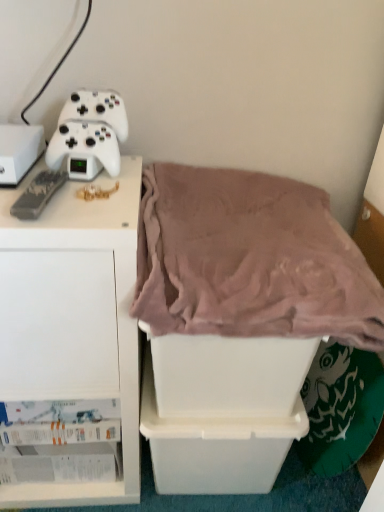
The image size is (384, 512). I want to click on mauve plush blanket at center, so click(x=250, y=260).

This screenshot has height=512, width=384. Describe the element at coordinates (228, 374) in the screenshot. I see `white plastic storage box at center, marked as the 2th storage box in a bottom-to-top arrangement` at that location.

The image size is (384, 512). What do you see at coordinates (216, 447) in the screenshot? I see `white plastic storage box at lower center, the 2th storage box when ordered from left to right` at bounding box center [216, 447].

What is the approximate height of white plastic storage box at lower center, the 3th storage box when ordered from top to bottom?

11.72 inches.

What do you see at coordinates (19, 151) in the screenshot? I see `white plastic storage box at left, arranged as the 1th storage box when viewed from the top` at bounding box center [19, 151].

Locate an element on the screen. white matte cabinet at left is located at coordinates (73, 319).

Is the depth of white plastic storage box at lower center, the 2th storage box when ordered from left to right, greater than that of mauve plush blanket at center?

Yes, it is.

Would you say white plastic storage box at lower center, the 3th storage box when ordered from top to bottom, is inside or outside mauve plush blanket at center?

The correct answer is: outside.

Which object is wider, white plastic storage box at lower center, the first storage box positioned from the bottom, or mauve plush blanket at center?

mauve plush blanket at center.

From a real-world perspective, is white plastic storage box at lower center, the first storage box positioned from the bottom, above or below mauve plush blanket at center?

From a real-world perspective, white plastic storage box at lower center, the first storage box positioned from the bottom, is physically below mauve plush blanket at center.

From the image's perspective, between white plastic storage box at lower center, the 2th storage box when ordered from right to left, and white plastic storage box at left, the third storage box when ordered from right to left, who is located below?

white plastic storage box at lower center, the 2th storage box when ordered from right to left, is shown below in the image.

Which is nearer, (191, 446) or (36, 133)?

Point (191, 446) appears to be farther away from the viewer than point (36, 133).

Can white plastic storage box at left, the third storage box when ordered from right to left, be found inside white plastic storage box at lower center, the first storage box positioned from the bottom?

Definitely not — white plastic storage box at left, the third storage box when ordered from right to left, is not inside white plastic storage box at lower center, the first storage box positioned from the bottom.

Can you tell me how much white plastic storage box at left, which appears as the 3th storage box when ordered from the bottom, and mauve plush blanket at center differ in facing direction?

The angular difference between white plastic storage box at left, which appears as the 3th storage box when ordered from the bottom, and mauve plush blanket at center is 0.141 degrees.

You are a GUI agent. You are given a task and a screenshot of the screen. Output one action in this format:
    pyautogui.click(x=<x>, y=<y>)
    Task: Click on the blanket in front of the white plastic storage box at left, placed as the 1th storage box when sorted from left to right
    The image size is (384, 512).
    Given the screenshot: What is the action you would take?
    pyautogui.click(x=250, y=260)

From a real-world perspective, is white plastic storage box at left, the third storage box when ordered from right to left, on mauve plush blanket at center?

Yes, from a real-world perspective, white plastic storage box at left, the third storage box when ordered from right to left, is over mauve plush blanket at center

Which point is more distant from viewer, (22, 170) or (156, 205)?

Point (156, 205)

Which object is thinner, white plastic storage box at center, acting as the third storage box starting from the left, or white plastic storage box at left, arranged as the 1th storage box when viewed from the top?

white plastic storage box at left, arranged as the 1th storage box when viewed from the top.

The image size is (384, 512). I want to click on the 1st storage box located beneath the white plastic storage box at left, which appears as the 3th storage box when ordered from the bottom (from a real-world perspective), so click(x=228, y=374).

Is point (273, 354) more distant than point (14, 172)?

Yes, it is behind point (14, 172).

Looking at this image, which object is positioned more to the left, white plastic storage box at center, acting as the third storage box starting from the left, or white plastic storage box at left, placed as the 1th storage box when sorted from left to right?

white plastic storage box at left, placed as the 1th storage box when sorted from left to right, is more to the left.

From a real-world perspective, is white matte game controller at upper left, which is the 2th game controller in bottom-to-top order, physically above white matte cabinet at left?

Yes, from a real-world perspective, white matte game controller at upper left, which is the 2th game controller in bottom-to-top order, is over white matte cabinet at left

Can you confirm if white matte game controller at upper left, placed as the 1th game controller when sorted from top to bottom, is thinner than white matte cabinet at left?

Yes, white matte game controller at upper left, placed as the 1th game controller when sorted from top to bottom, is thinner than white matte cabinet at left.

Is there a large distance between white matte game controller at upper left, the 2th game controller in the front-to-back sequence, and white matte cabinet at left?

No, white matte game controller at upper left, the 2th game controller in the front-to-back sequence, is in close proximity to white matte cabinet at left.

Does white matte game controller at upper left, placed as the 1th game controller when sorted from top to bottom, appear on the right side of white matte cabinet at left?

Yes.

Consider the image. Considering the sizes of objects white matte cabinet at left and white plastic storage box at left, the third storage box when ordered from right to left, in the image provided, who is thinner, white matte cabinet at left or white plastic storage box at left, the third storage box when ordered from right to left,?

white plastic storage box at left, the third storage box when ordered from right to left.

Locate an element on the screen. This screenshot has width=384, height=512. storage box located on the left of white matte cabinet at left is located at coordinates (19, 151).

Who is more distant, white matte cabinet at left or white plastic storage box at left, which appears as the 3th storage box when ordered from the bottom?

white plastic storage box at left, which appears as the 3th storage box when ordered from the bottom, is behind.

Does white matte cabinet at left appear on the right side of white plastic storage box at left, placed as the 1th storage box when sorted from left to right?

Indeed, white matte cabinet at left is positioned on the right side of white plastic storage box at left, placed as the 1th storage box when sorted from left to right.

From a real-world perspective, is mauve plush blanket at center on top of black matte game controller at left, marked as the second game controller in a top-to-bottom arrangement?

Actually, mauve plush blanket at center is physically below black matte game controller at left, marked as the second game controller in a top-to-bottom arrangement, in the real world.

Does point (340, 247) come behind point (33, 187)?

Yes, point (340, 247) is behind point (33, 187).

Between mauve plush blanket at center and black matte game controller at left, which is the second game controller in back-to-front order, which one has less height?

black matte game controller at left, which is the second game controller in back-to-front order.

Is mauve plush blanket at center facing towards black matte game controller at left, marked as the second game controller in a top-to-bottom arrangement?

No, mauve plush blanket at center is not aimed at black matte game controller at left, marked as the second game controller in a top-to-bottom arrangement.

Identify the location of storage box that is the 3rd object located behind the mauve plush blanket at center. (216, 447).

What are the coordinates of `the 2nd storage box located above the white plastic storage box at lower center, the 2th storage box when ordered from right to left (from a real-world perspective)` in the screenshot? It's located at (19, 151).

Looking at the image, which one is located closer to white matte cabinet at left, mauve plush blanket at center or black matte game controller at left, which is counted as the first game controller, starting from the bottom?

Among the two, mauve plush blanket at center is located nearer to white matte cabinet at left.

Looking at the image, which one is located further to white matte cabinet at left, white matte game controller at upper left, the 2th game controller in the front-to-back sequence, or white plastic storage box at left, placed as the 1th storage box when sorted from left to right?

white plastic storage box at left, placed as the 1th storage box when sorted from left to right, lies further to white matte cabinet at left than the other object.

Estimate the real-world distances between objects in this image. Which object is further from white matte game controller at upper left, which is the 2th game controller in bottom-to-top order, mauve plush blanket at center or white matte cabinet at left?

mauve plush blanket at center is further to white matte game controller at upper left, which is the 2th game controller in bottom-to-top order.

When comparing their distances from white plastic storage box at center, marked as the 2th storage box in a bottom-to-top arrangement, does black matte game controller at left, which is the first game controller in front-to-back order, or white plastic storage box at left, arranged as the 1th storage box when viewed from the top, seem closer?

black matte game controller at left, which is the first game controller in front-to-back order, is positioned closer to the anchor white plastic storage box at center, marked as the 2th storage box in a bottom-to-top arrangement.

From the image, which object appears to be farther from mauve plush blanket at center, white matte cabinet at left or white plastic storage box at left, placed as the 1th storage box when sorted from left to right?

white plastic storage box at left, placed as the 1th storage box when sorted from left to right.

Considering their positions, is mauve plush blanket at center positioned closer to white plastic storage box at lower center, the 3th storage box when ordered from top to bottom, than black matte game controller at left, marked as the second game controller in a top-to-bottom arrangement?

Based on the image, mauve plush blanket at center appears to be nearer to white plastic storage box at lower center, the 3th storage box when ordered from top to bottom.

Which object lies further to the anchor point black matte game controller at left, which is the second game controller in back-to-front order, white plastic storage box at center, which is counted as the first storage box, starting from the right, or mauve plush blanket at center?

Among the two, white plastic storage box at center, which is counted as the first storage box, starting from the right, is located further to black matte game controller at left, which is the second game controller in back-to-front order.

When comparing their distances from black matte game controller at left, which is the first game controller in front-to-back order, does white plastic storage box at left, placed as the 1th storage box when sorted from left to right, or white plastic storage box at center, marked as the 2th storage box in a bottom-to-top arrangement, seem closer?

Among the two, white plastic storage box at left, placed as the 1th storage box when sorted from left to right, is located nearer to black matte game controller at left, which is the first game controller in front-to-back order.

This screenshot has width=384, height=512. What are the coordinates of `furniture located between white plastic storage box at left, the third storage box when ordered from right to left, and mauve plush blanket at center in the left-right direction` in the screenshot? It's located at (73, 319).

Where is `furniture between white plastic storage box at left, the third storage box when ordered from right to left, and white plastic storage box at center, the second storage box from the top`? The image size is (384, 512). furniture between white plastic storage box at left, the third storage box when ordered from right to left, and white plastic storage box at center, the second storage box from the top is located at coordinates (73, 319).

You are a GUI agent. You are given a task and a screenshot of the screen. Output one action in this format:
    pyautogui.click(x=<x>, y=<y>)
    Task: Click on the furniture between white plastic storage box at left, which appears as the 3th storage box when ordered from the bottom, and white plastic storage box at lower center, the 2th storage box when ordered from left to right, in the up-down direction
    
    Given the screenshot: What is the action you would take?
    pyautogui.click(x=73, y=319)

The height and width of the screenshot is (512, 384). Find the location of `game controller that lies between white matte game controller at upper left, the first game controller when ordered from back to front, and white matte cabinet at left from top to bottom`. game controller that lies between white matte game controller at upper left, the first game controller when ordered from back to front, and white matte cabinet at left from top to bottom is located at coordinates (38, 194).